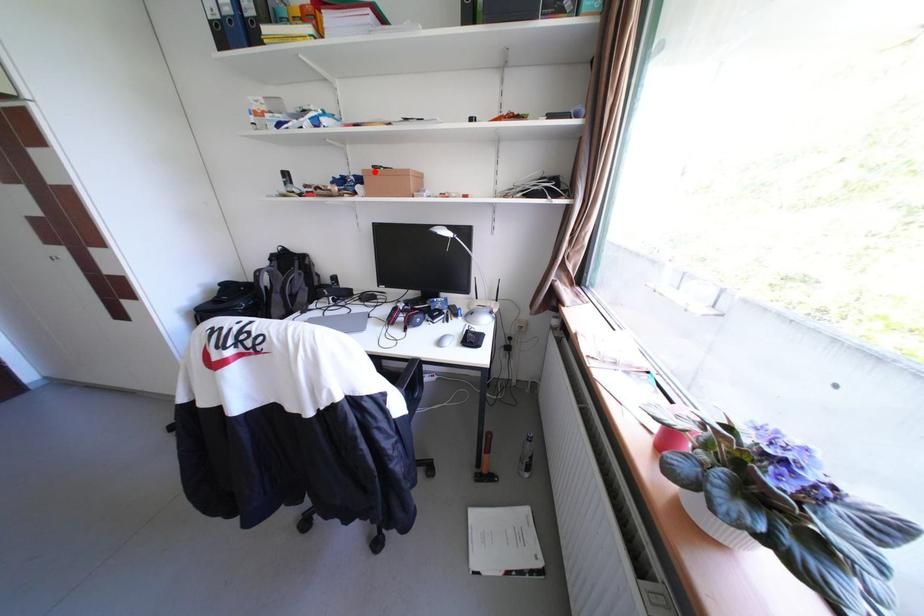
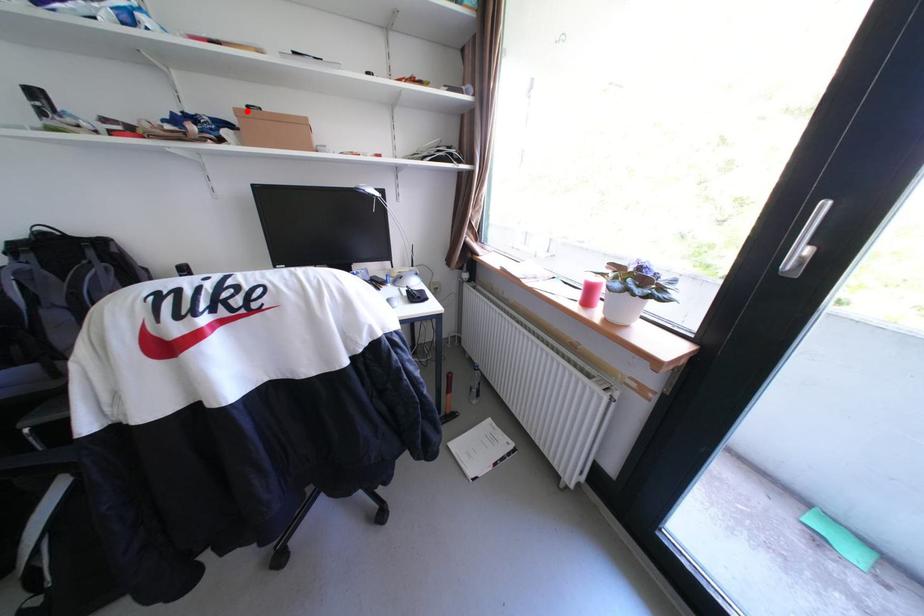
I am providing you with two images of the same scene from different viewpoints. A red point is marked on the first image and another point is marked on the second image. Do the highlighted points in image1 and image2 indicate the same real-world spot?

Yes